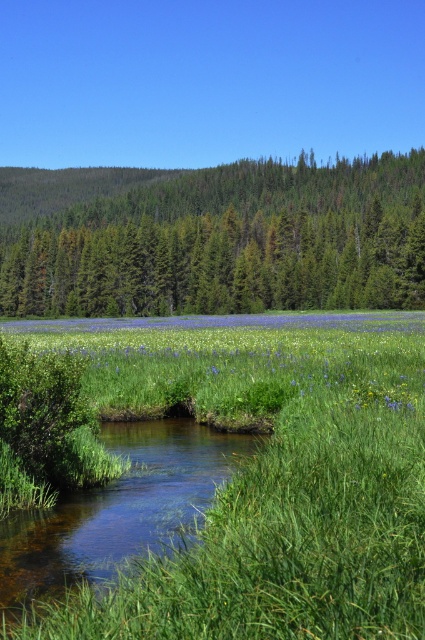
You are standing at the origin point of the image. Which direction should you move to reach the green textured trees at upper center?

The green textured trees at upper center are located at point (214, 237), so you should move towards the upper center direction to reach them.